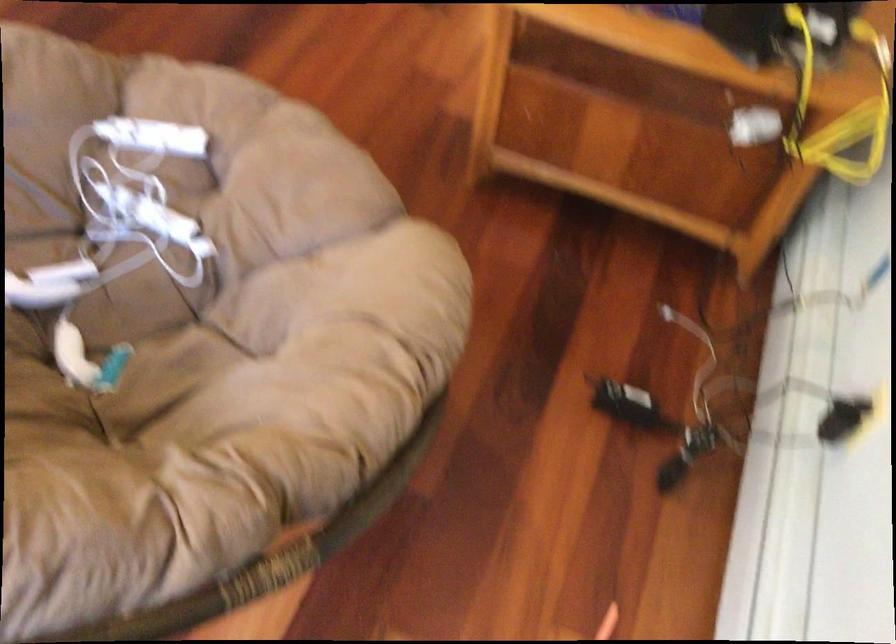
The image size is (896, 644). Identify the location of brown chair sitting surface. (181, 205).